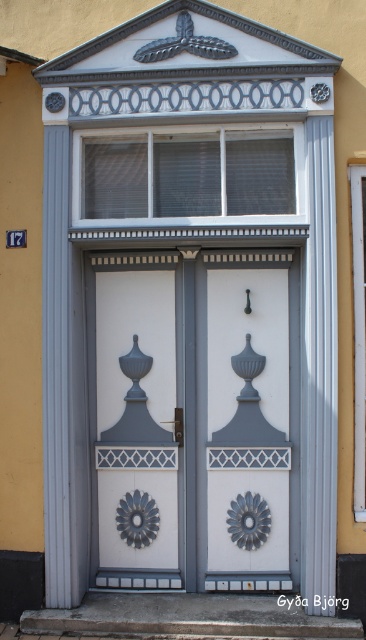
Question: Where is white painted wood door at center located in relation to matte gray door at center in the image?

Choices:
 (A) below
 (B) above

Answer: (B)

Question: Does matte gray door at center have a smaller size compared to white glossy door at center?

Choices:
 (A) yes
 (B) no

Answer: (B)

Question: Which point is closer to the camera?

Choices:
 (A) (105, 145)
 (B) (181, 360)

Answer: (A)

Question: Among these objects, which one is nearest to the camera?

Choices:
 (A) matte gray door at center
 (B) clear glass window at upper center
 (C) white glossy door at center
 (D) white painted wood door at center

Answer: (B)

Question: Can you confirm if white painted wood door at center is positioned above clear glass window at upper center?

Choices:
 (A) yes
 (B) no

Answer: (B)

Question: Which object is farther from the camera taking this photo?

Choices:
 (A) white glossy door at center
 (B) white painted wood door at center
 (C) clear glass window at upper center

Answer: (A)